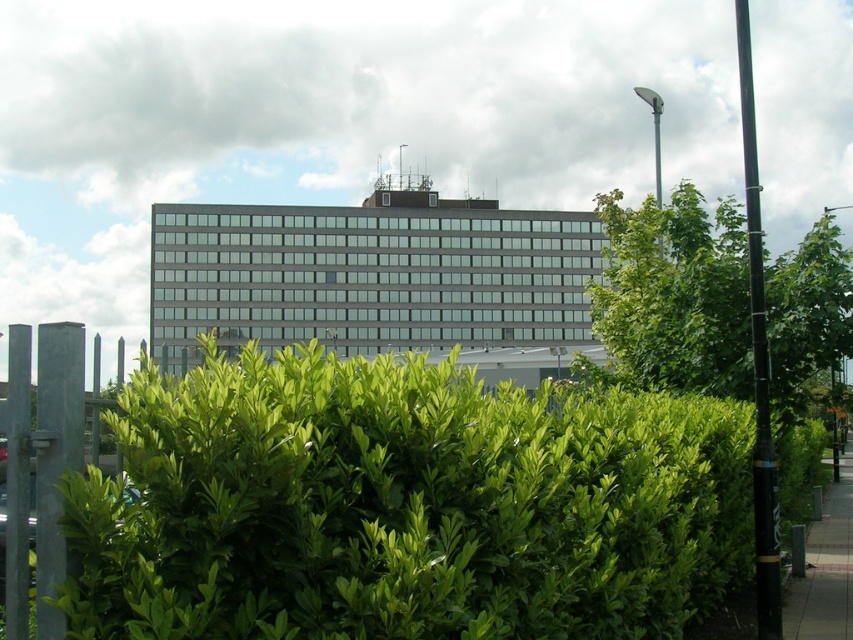
Is green leafy hedge at left thinner than green leafy tree at right?

Correct, green leafy hedge at left's width is less than green leafy tree at right's.

Is point (265, 573) closer to viewer compared to point (606, 314)?

That is True.

The width and height of the screenshot is (853, 640). Identify the location of green leafy hedge at left. (405, 506).

Between green leafy hedge at left and paved concrete sidewalk at lower right, which one appears on the left side from the viewer's perspective?

green leafy hedge at left is more to the left.

Is green leafy hedge at left below paved concrete sidewalk at lower right?

No.

Who is more forward, (103, 525) or (805, 621)?

Point (103, 525)

At what (x,y) coordinates should I click in order to perform the action: click on green leafy hedge at left. Please return your answer as a coordinate pair (x, y). Image resolution: width=853 pixels, height=640 pixels. Looking at the image, I should click on (405, 506).

Is green leafy tree at right wider than paved concrete sidewalk at lower right?

Yes.

Between point (604, 285) and point (816, 582), which one is positioned in front?

Point (816, 582) is more forward.

Between point (834, 340) and point (846, 484), which one is positioned in front?

Point (834, 340) is in front.

Find the location of a particular element. The width and height of the screenshot is (853, 640). green leafy tree at right is located at coordinates (674, 296).